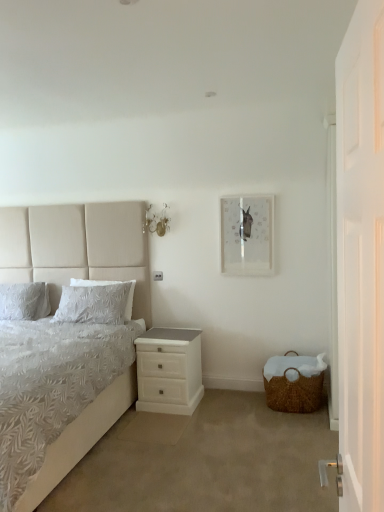
Question: Would you say woven brown basket at lower right is a long distance from white glossy nightstand at lower center?

Choices:
 (A) no
 (B) yes

Answer: (A)

Question: From the image's perspective, is woven brown basket at lower right beneath white glossy nightstand at lower center?

Choices:
 (A) no
 (B) yes

Answer: (B)

Question: Can you confirm if woven brown basket at lower right is smaller than white glossy nightstand at lower center?

Choices:
 (A) no
 (B) yes

Answer: (B)

Question: Is woven brown basket at lower right located outside white glossy nightstand at lower center?

Choices:
 (A) no
 (B) yes

Answer: (B)

Question: Can you confirm if woven brown basket at lower right is thinner than white glossy nightstand at lower center?

Choices:
 (A) no
 (B) yes

Answer: (B)

Question: Would you say white textured pillow at left, which is counted as the second pillow, starting from the left, is to the left or to the right of white textured bed at left in the picture?

Choices:
 (A) right
 (B) left

Answer: (A)

Question: From a real-world perspective, is white textured pillow at left, the first pillow when ordered from right to left, physically located above or below white textured bed at left?

Choices:
 (A) below
 (B) above

Answer: (A)

Question: Is white textured pillow at left, which is counted as the second pillow, starting from the left, taller or shorter than white textured bed at left?

Choices:
 (A) tall
 (B) short

Answer: (B)

Question: Relative to white textured bed at left, is white textured pillow at left, which is counted as the second pillow, starting from the left, in front or behind?

Choices:
 (A) front
 (B) behind

Answer: (B)

Question: Considering the positions of white textured pillow at left, the first pillow when ordered from right to left, and clear glass picture frame at upper center in the image, is white textured pillow at left, the first pillow when ordered from right to left, taller or shorter than clear glass picture frame at upper center?

Choices:
 (A) short
 (B) tall

Answer: (A)

Question: Based on their positions, is white textured pillow at left, which is counted as the second pillow, starting from the left, located to the left or right of clear glass picture frame at upper center?

Choices:
 (A) right
 (B) left

Answer: (B)

Question: From a real-world perspective, is white textured pillow at left, the first pillow when ordered from right to left, positioned above or below clear glass picture frame at upper center?

Choices:
 (A) above
 (B) below

Answer: (B)

Question: In the image, is white textured pillow at left, the first pillow when ordered from right to left, positioned in front of or behind clear glass picture frame at upper center?

Choices:
 (A) behind
 (B) front

Answer: (A)

Question: Is white wooden door at right wider or thinner than white textured pillow at left, which is counted as the second pillow, starting from the left?

Choices:
 (A) wide
 (B) thin

Answer: (B)

Question: From a real-world perspective, is white wooden door at right above or below white textured pillow at left, which is counted as the second pillow, starting from the left?

Choices:
 (A) above
 (B) below

Answer: (A)